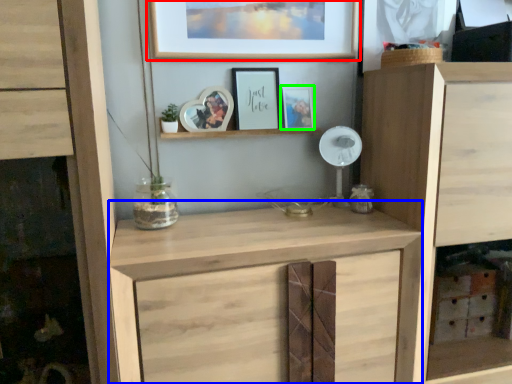
Question: Which object is the closest to the picture frame (highlighted by a red box)? Choose among these: cabinetry (highlighted by a blue box) or picture frame (highlighted by a green box).

Choices:
 (A) cabinetry
 (B) picture frame

Answer: (B)